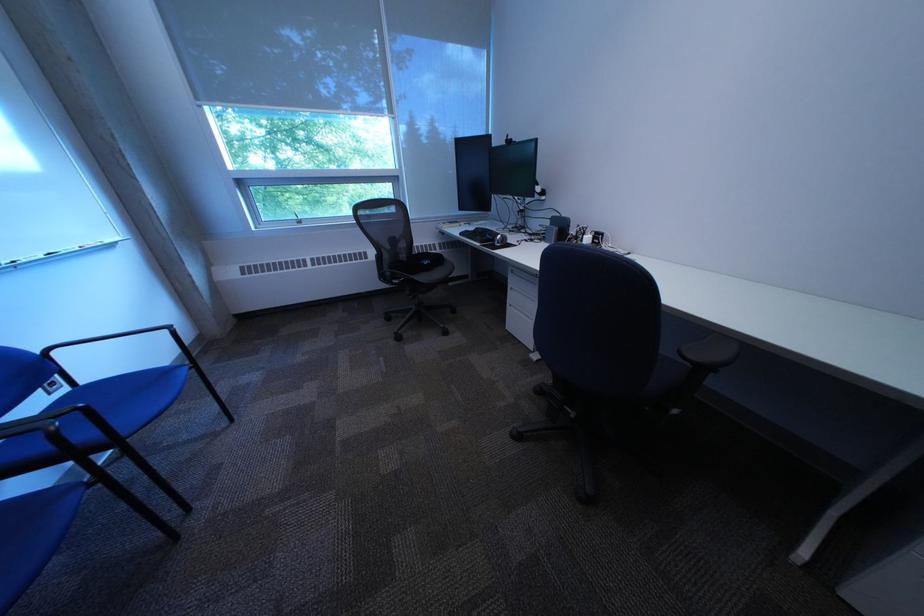
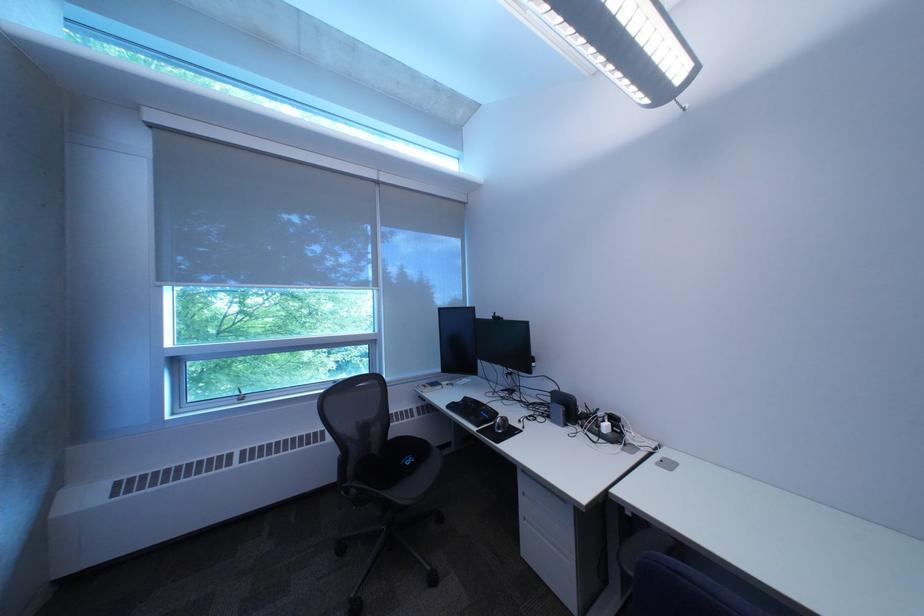
Question: I am providing you with two images of the same scene from different viewpoints. Please identify which objects are invisible in image2.

Choices:
 (A) black computer mouse
 (B) cabinet drawer handle
 (C) black chair sitting surface
 (D) none of these

Answer: (D)